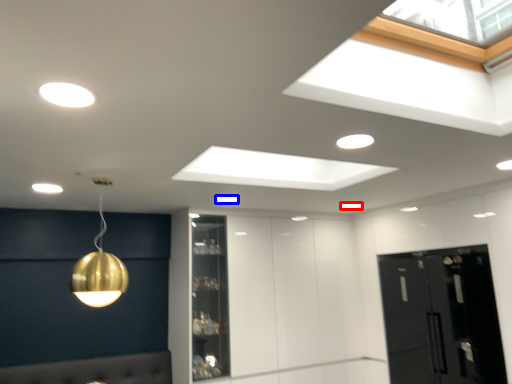
Question: Which object appears closest to the camera in this image, lamp (highlighted by a red box) or lamp (highlighted by a blue box)?

Choices:
 (A) lamp
 (B) lamp

Answer: (B)